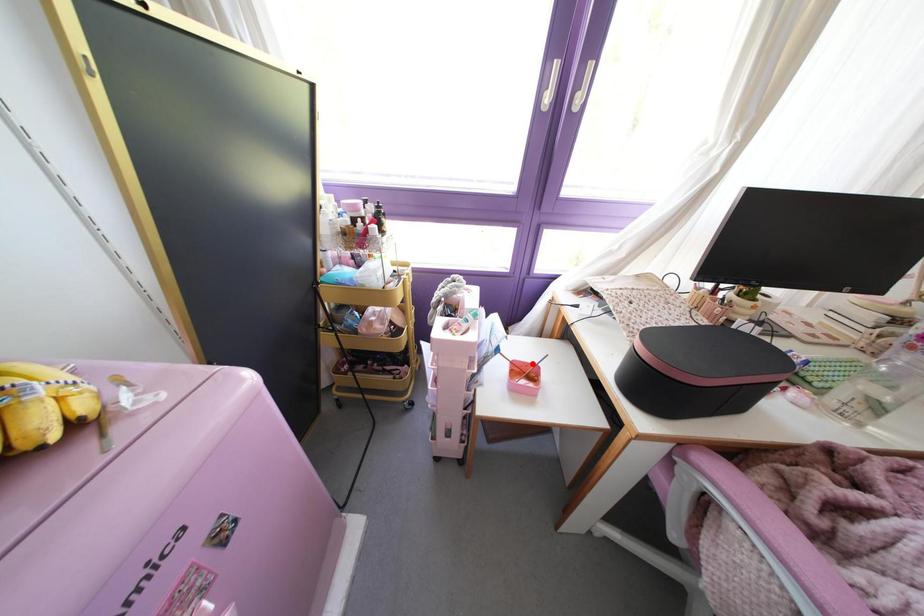
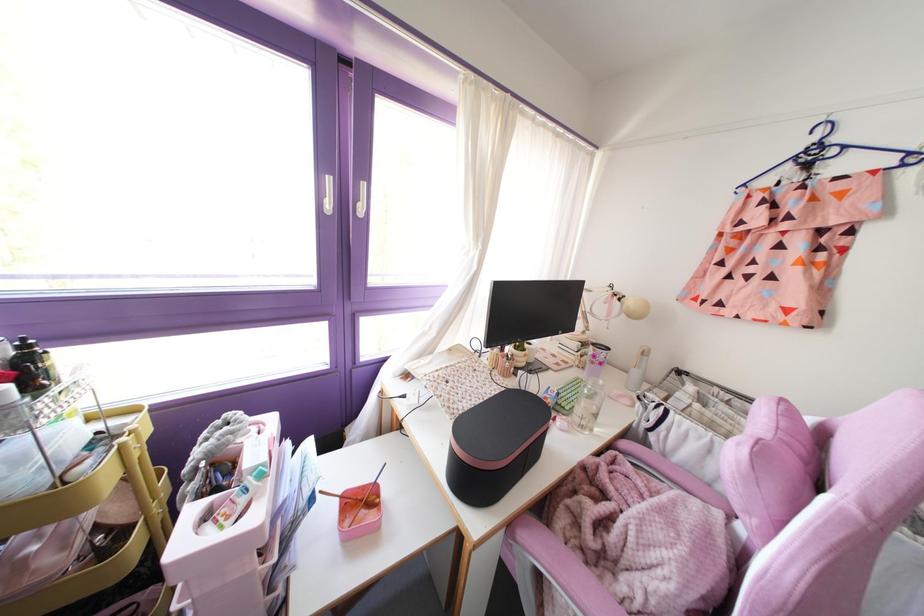
Find the pixel in the second image that matches the highlighted location in the first image.

(370, 484)